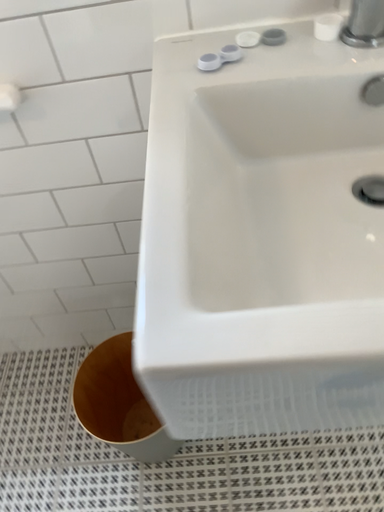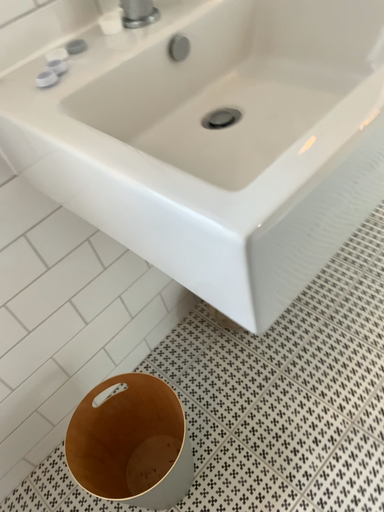
Question: Which way did the camera rotate in the video?

Choices:
 (A) rotated left
 (B) rotated right

Answer: (B)